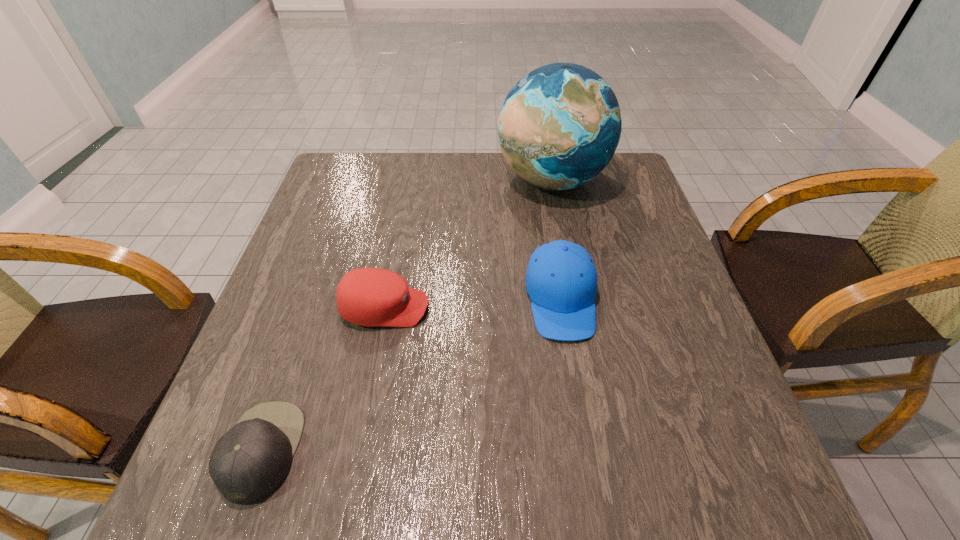
The image size is (960, 540). Find the location of `free space located on the brim of the leftmost object`. free space located on the brim of the leftmost object is located at coordinates (430, 450).

Where is `object at the far edge`? object at the far edge is located at coordinates (559, 127).

Locate an element on the screen. Image resolution: width=960 pixels, height=540 pixels. object situated at the near edge is located at coordinates (250, 461).

Locate an element on the screen. Image resolution: width=960 pixels, height=540 pixels. object that is at the right edge is located at coordinates (559, 127).

Locate an element on the screen. This screenshot has width=960, height=540. object at the near left corner is located at coordinates click(250, 461).

Where is `object that is at the far right corner`? Image resolution: width=960 pixels, height=540 pixels. object that is at the far right corner is located at coordinates (559, 127).

Identify the location of free space at the far edge of the desktop. This screenshot has height=540, width=960. (501, 159).

This screenshot has height=540, width=960. Find the location of `vacant space at the near edge of the desktop`. vacant space at the near edge of the desktop is located at coordinates (448, 495).

Image resolution: width=960 pixels, height=540 pixels. I want to click on vacant space at the left edge of the desktop, so click(335, 319).

In the image, there is a desktop. Where is `vacant space at the right edge`? The width and height of the screenshot is (960, 540). vacant space at the right edge is located at coordinates (601, 251).